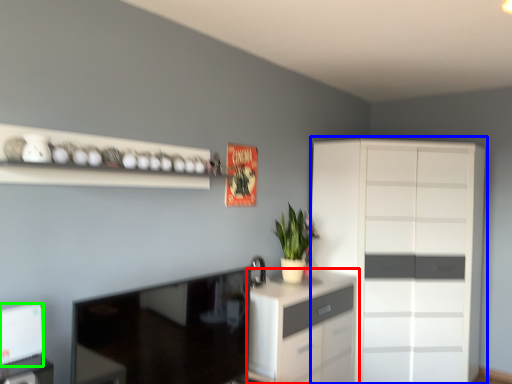
Question: Which object is the closest to the chest of drawers (highlighted by a red box)? Choose among these: cupboard (highlighted by a blue box) or appliance (highlighted by a green box).

Choices:
 (A) cupboard
 (B) appliance

Answer: (A)